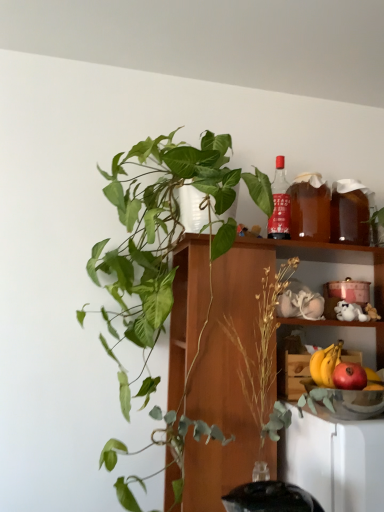
Question: From the image's perspective, is red glass bottle at upper right over brown translucent beverage at upper right, the first beverage from the left?

Choices:
 (A) no
 (B) yes

Answer: (B)

Question: Does red glass bottle at upper right have a larger size compared to brown translucent beverage at upper right, the first beverage from the left?

Choices:
 (A) yes
 (B) no

Answer: (B)

Question: Is red glass bottle at upper right shorter than brown translucent beverage at upper right, the 2th beverage positioned from the right?

Choices:
 (A) no
 (B) yes

Answer: (A)

Question: Is red glass bottle at upper right in contact with brown translucent beverage at upper right, the 2th beverage positioned from the right?

Choices:
 (A) no
 (B) yes

Answer: (B)

Question: Considering the relative positions of red glass bottle at upper right and brown translucent beverage at upper right, the 2th beverage positioned from the right, in the image provided, is red glass bottle at upper right to the right of brown translucent beverage at upper right, the 2th beverage positioned from the right, from the viewer's perspective?

Choices:
 (A) no
 (B) yes

Answer: (A)

Question: Considering the positions of yellow matte banana at lower right and transparent glass bowl at lower right in the image, is yellow matte banana at lower right taller or shorter than transparent glass bowl at lower right?

Choices:
 (A) tall
 (B) short

Answer: (A)

Question: Choose the correct answer: Is yellow matte banana at lower right inside transparent glass bowl at lower right or outside it?

Choices:
 (A) inside
 (B) outside

Answer: (B)

Question: Based on their sizes in the image, would you say yellow matte banana at lower right is bigger or smaller than transparent glass bowl at lower right?

Choices:
 (A) small
 (B) big

Answer: (A)

Question: From a real-world perspective, is yellow matte banana at lower right positioned above or below transparent glass bowl at lower right?

Choices:
 (A) below
 (B) above

Answer: (B)

Question: From a real-world perspective, is yellow matte banana at lower right above or below red glass bottle at upper right?

Choices:
 (A) below
 (B) above

Answer: (A)

Question: Considering the relative positions of yellow matte banana at lower right and red glass bottle at upper right in the image provided, is yellow matte banana at lower right to the left or to the right of red glass bottle at upper right?

Choices:
 (A) left
 (B) right

Answer: (B)

Question: From the image's perspective, is yellow matte banana at lower right positioned above or below red glass bottle at upper right?

Choices:
 (A) below
 (B) above

Answer: (A)

Question: In terms of width, does yellow matte banana at lower right look wider or thinner when compared to red glass bottle at upper right?

Choices:
 (A) wide
 (B) thin

Answer: (B)

Question: Is translucent amber liquid at shelf right, arranged as the 2th beverage when viewed from the left, bigger or smaller than red glass bottle at upper right?

Choices:
 (A) small
 (B) big

Answer: (B)

Question: From their relative heights in the image, would you say translucent amber liquid at shelf right, arranged as the 1th beverage when viewed from the right, is taller or shorter than red glass bottle at upper right?

Choices:
 (A) tall
 (B) short

Answer: (B)